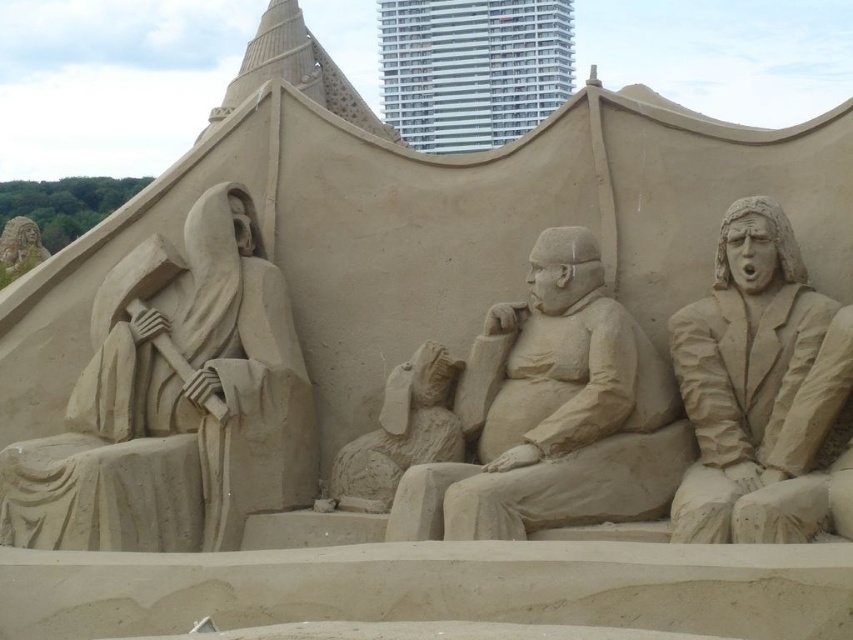
Question: Is smooth sand sculpture at center behind smooth sand figure at right?

Choices:
 (A) no
 (B) yes

Answer: (B)

Question: Observing the image, what is the correct spatial positioning of smooth sand figure at right in reference to smooth sand rabbit at center?

Choices:
 (A) right
 (B) left

Answer: (A)

Question: Does smooth sand sculpture at center appear over smooth sand rabbit at center?

Choices:
 (A) yes
 (B) no

Answer: (A)

Question: Which is farther from the smooth sand sculpture at left?

Choices:
 (A) smooth sand rabbit at center
 (B) smooth sand sculpture at center
 (C) smooth sand figure at right

Answer: (C)

Question: Among these objects, which one is nearest to the camera?

Choices:
 (A) smooth sand rabbit at center
 (B) smooth sand sculpture at center

Answer: (B)

Question: Which object is closer to the camera taking this photo?

Choices:
 (A) smooth sand figure at right
 (B) smooth sand rabbit at center
 (C) smooth sand sculpture at center
 (D) smooth sand sculpture at left

Answer: (A)